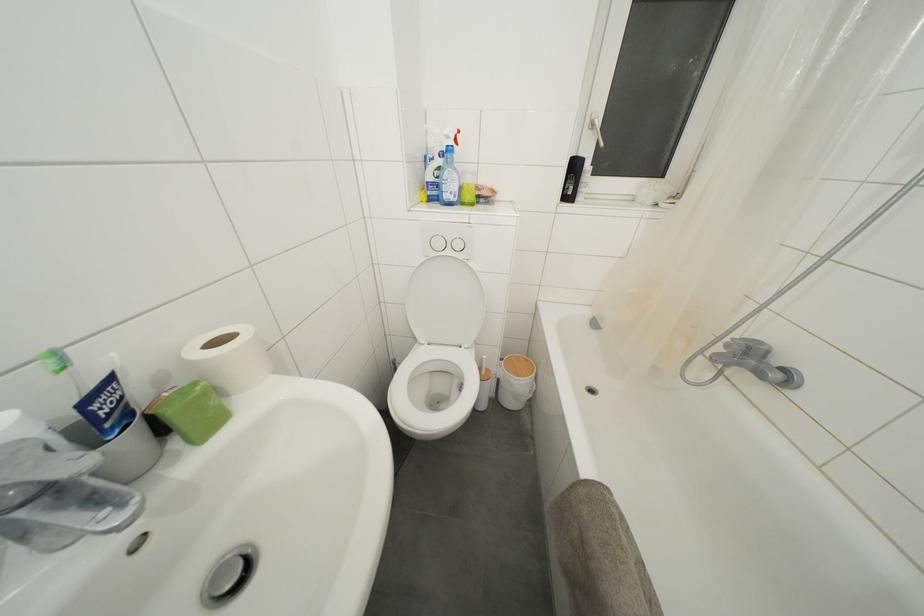
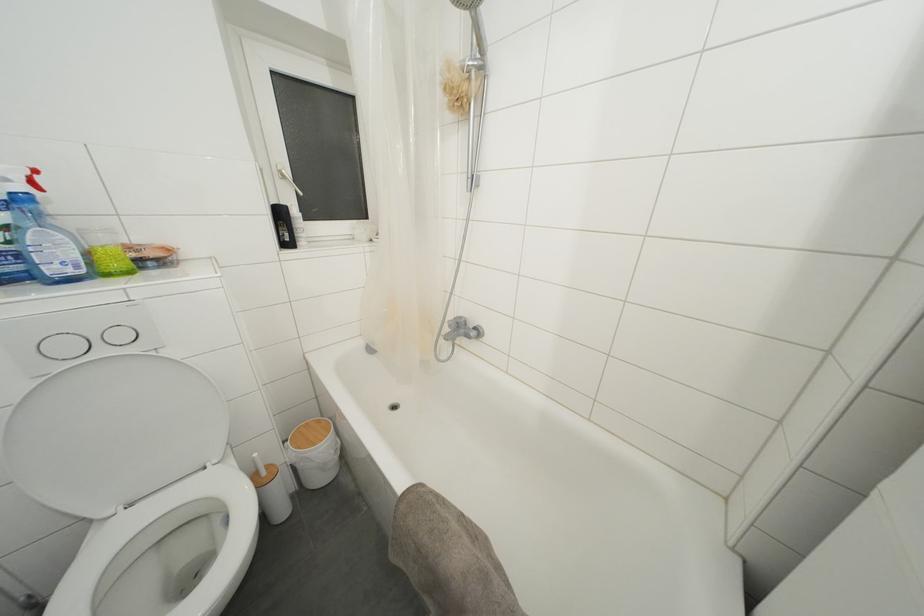
Question: The camera is either moving clockwise (left) or counter-clockwise (right) around the object. The first image is from the beginning of the video and the second image is from the end. Is the camera moving left or right when shooting the video?

Choices:
 (A) Left
 (B) Right

Answer: (A)